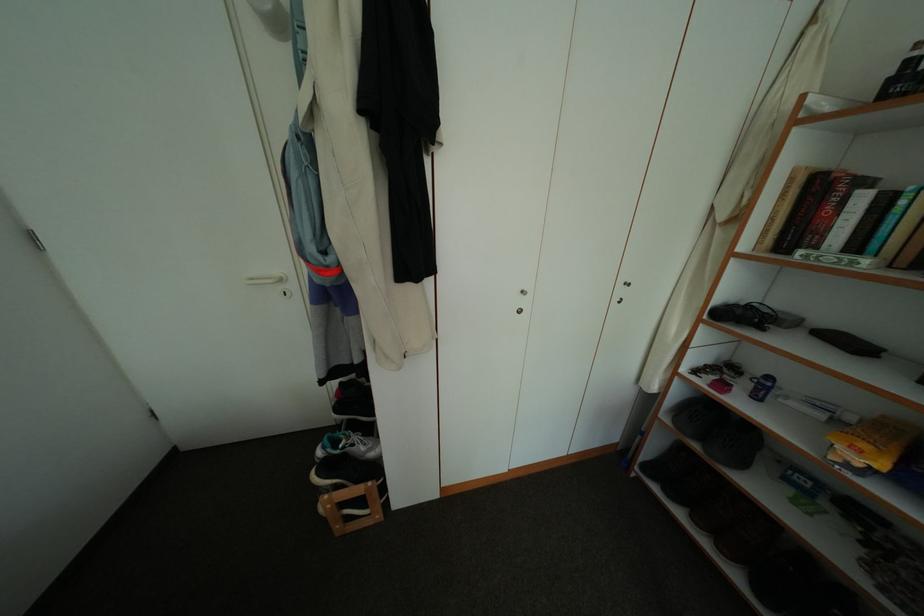
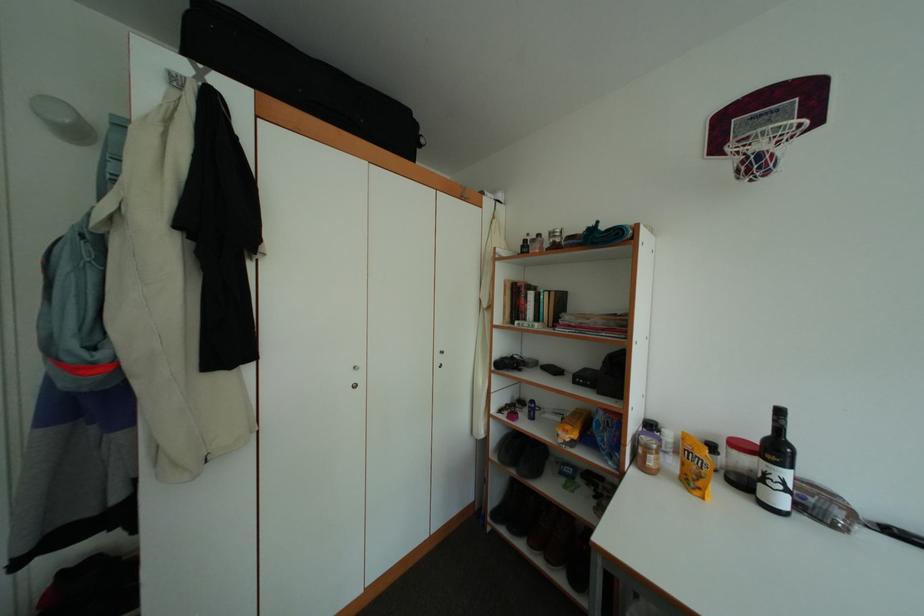
How did the camera likely rotate?

The camera's rotation is toward right-up.